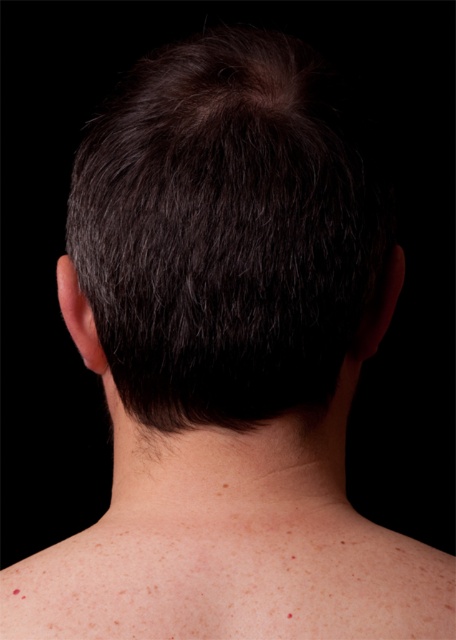
Is dark brown hair at center to the left of skinsmoothneck at center from the viewer's perspective?

Correct, you'll find dark brown hair at center to the left of skinsmoothneck at center.

Does dark brown hair at center have a lesser width compared to skinsmoothneck at center?

No, dark brown hair at center is not thinner than skinsmoothneck at center.

Who is more distant from viewer, (341, 160) or (125, 461)?

The point (125, 461) is behind.

Where is `dark brown hair at center`? dark brown hair at center is located at coordinates (227, 234).